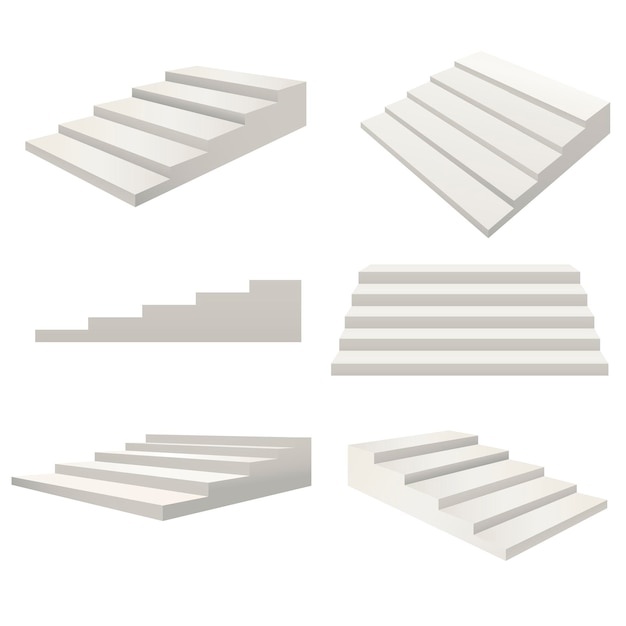
Image resolution: width=626 pixels, height=626 pixels. In order to click on staircase in this screenshot , I will do `click(133, 101)`, `click(476, 124)`, `click(426, 302)`, `click(240, 327)`, `click(203, 474)`, `click(428, 476)`.